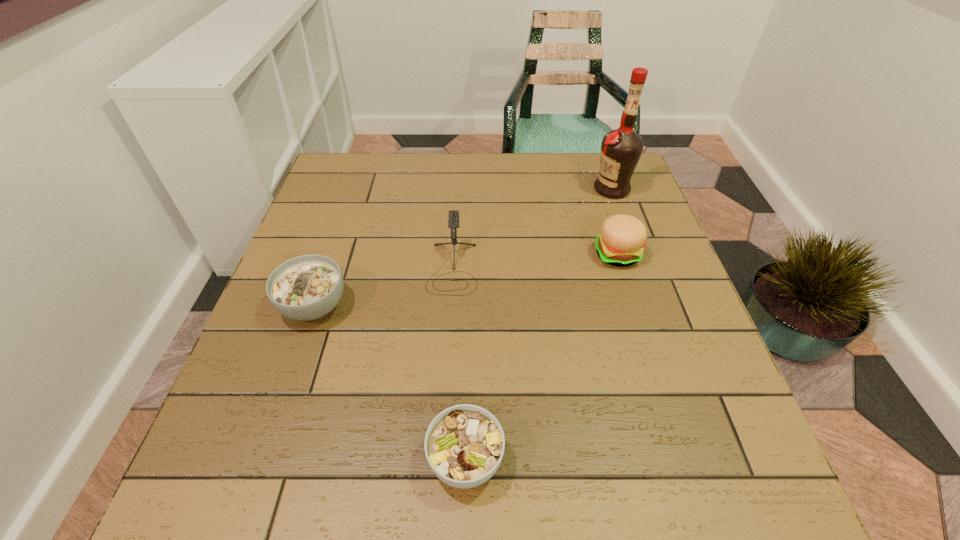
I want to click on the farthest object, so click(x=621, y=149).

Where is `the tallest object`? The height and width of the screenshot is (540, 960). the tallest object is located at coordinates coord(621,149).

At what (x,y) coordinates should I click in order to perform the action: click on microphone. Please return your answer as a coordinate pair (x, y). This screenshot has height=540, width=960. Looking at the image, I should click on (453, 220).

Where is `hamburger`? This screenshot has width=960, height=540. hamburger is located at coordinates (620, 243).

Locate an element on the screen. The image size is (960, 540). the farther soup bowl is located at coordinates (307, 287).

Where is `the taller soup bowl`? The width and height of the screenshot is (960, 540). the taller soup bowl is located at coordinates (307, 287).

The height and width of the screenshot is (540, 960). I want to click on the nearest object, so [x=464, y=445].

This screenshot has height=540, width=960. Identify the location of the shorter soup bowl. (464, 445).

You are a GUI agent. You are given a task and a screenshot of the screen. Output one action in this format:
    pyautogui.click(x=<x>, y=<y>)
    Task: Click on the vacant space positioned on the front and back of the farthest object
    This screenshot has width=960, height=540.
    Given the screenshot: What is the action you would take?
    pyautogui.click(x=480, y=189)

Locate an element on the screen. This screenshot has width=960, height=540. blank space located on the front and back of the farthest object is located at coordinates (526, 189).